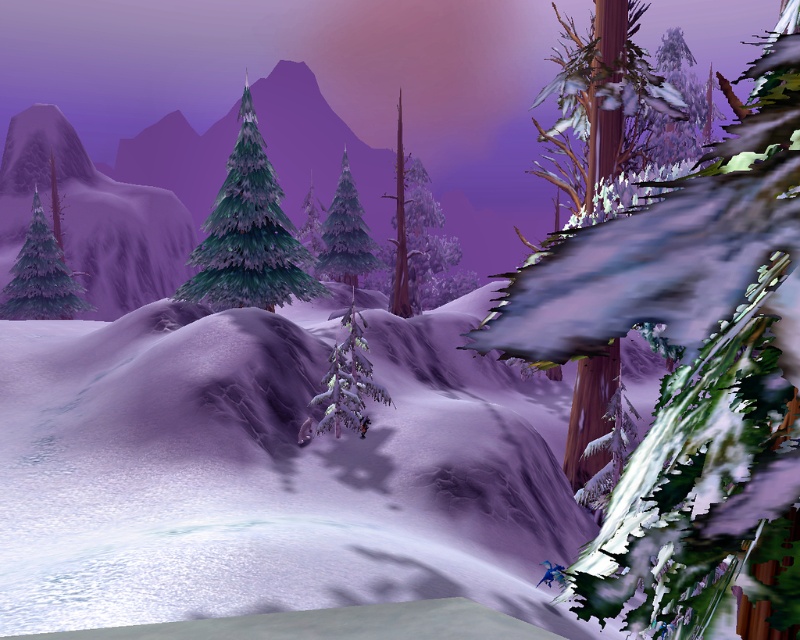
You are standing in the snowy mountain landscape and want to move from the point at coordinates point [240,204] to the point at coordinates point [325,392]. Which direction should you move to get closer to your destination?

To move from point [240,204] to point [325,392], you should move towards the right and upwards since point [325,392] is located to the right and higher up compared to point [240,204].